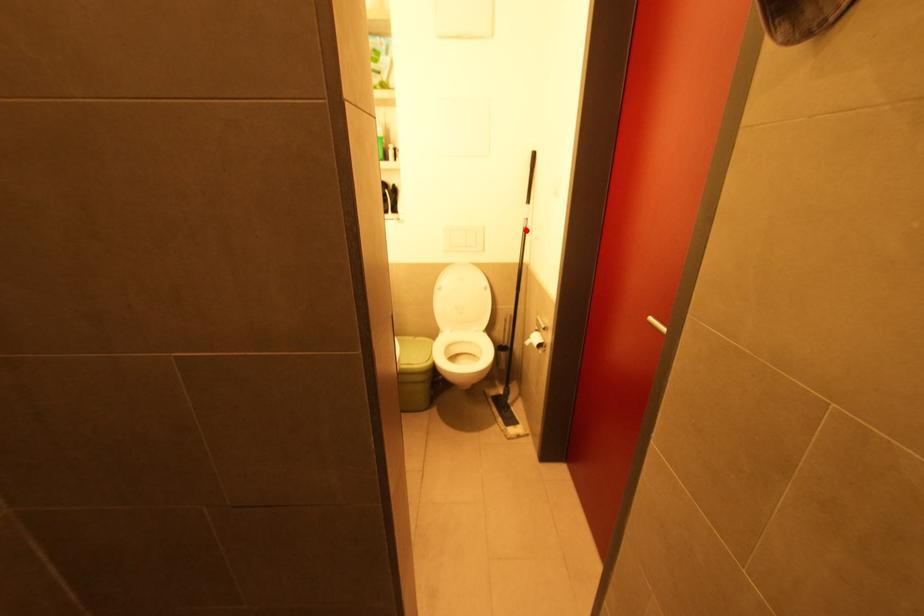
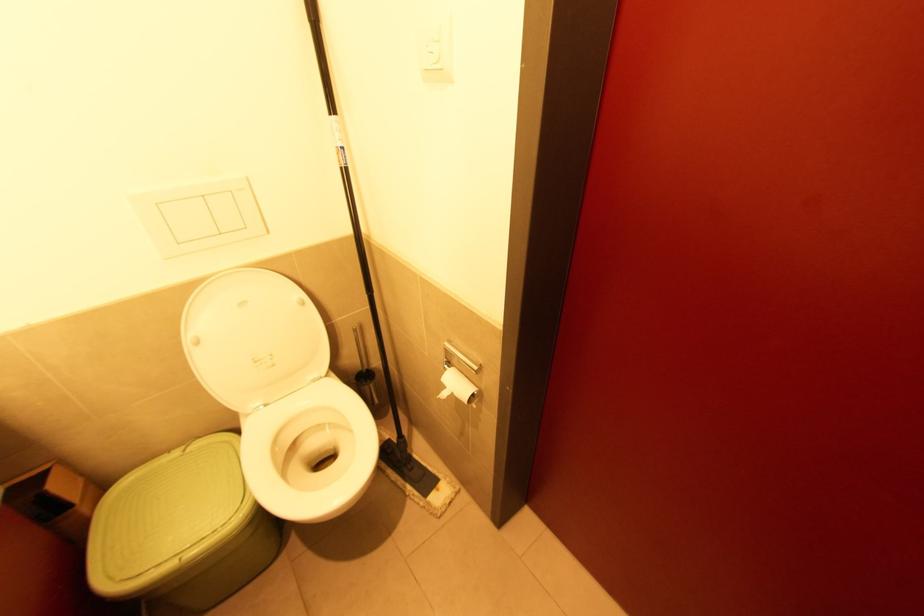
Question: I am providing you with two images of the same scene from different viewpoints. In image1, a red point is highlighted. Considering the same 3D point in image2, which of the following is correct?

Choices:
 (A) It is closer
 (B) It is farther

Answer: (B)